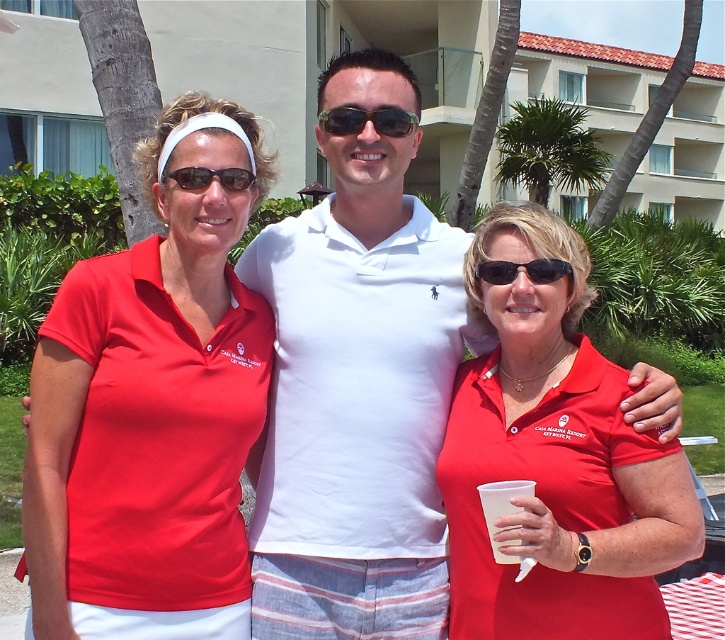
Question: Can you confirm if matte red polo shirt at left is positioned to the right of black plastic sunglasses at center?

Choices:
 (A) no
 (B) yes

Answer: (A)

Question: Is matte red polo shirt at left above white cotton polo shirt at center?

Choices:
 (A) yes
 (B) no

Answer: (A)

Question: Which of these objects is positioned farthest from the black plastic sunglasses at center?

Choices:
 (A) shiny black sunglasses at center
 (B) green leafy palm tree at upper center
 (C) matte red polo shirt at left
 (D) matte black sunglasses at center

Answer: (B)

Question: Which object is positioned closest to the black plastic sunglasses at center?

Choices:
 (A) matte red polo shirt at center
 (B) white cotton polo shirt at center

Answer: (A)

Question: Which of the following is the closest to the observer?

Choices:
 (A) (74, 621)
 (B) (613, 483)
 (C) (362, 122)
 (D) (181, 188)

Answer: (A)

Question: Does matte red polo shirt at center appear over matte black sunglasses at center?

Choices:
 (A) yes
 (B) no

Answer: (B)